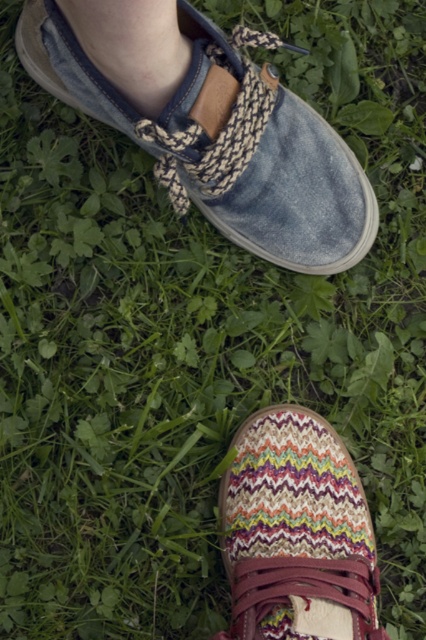
Does denim canvas shoe at upper center have a larger size compared to woven fabric shoe at lower center?

Correct, denim canvas shoe at upper center is larger in size than woven fabric shoe at lower center.

Between point (239, 234) and point (342, 532), which one is positioned behind?

Point (239, 234)

The image size is (426, 640). I want to click on denim canvas shoe at upper center, so click(x=207, y=124).

Is point (279, 458) positioned behind point (97, 1)?

Yes, it is behind point (97, 1).

Is woven fabric shoe at lower center bigger than skinny white sock at upper left?

Indeed, woven fabric shoe at lower center has a larger size compared to skinny white sock at upper left.

Locate an element on the screen. woven fabric shoe at lower center is located at coordinates (296, 532).

Which of these two, denim canvas shoe at upper center or skinny white sock at upper left, stands taller?

denim canvas shoe at upper center is taller.

Consider the image. Does denim canvas shoe at upper center have a greater width compared to skinny white sock at upper left?

Yes.

Measure the distance between point (173, 148) and camera.

The distance of point (173, 148) from camera is 1.09 meters.

Locate an element on the screen. denim canvas shoe at upper center is located at coordinates (207, 124).